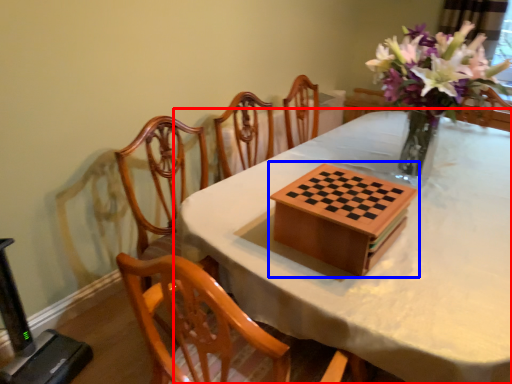
Question: Which point is closer to the camera, table (highlighted by a red box) or board game (highlighted by a blue box)?

Choices:
 (A) table
 (B) board game

Answer: (A)